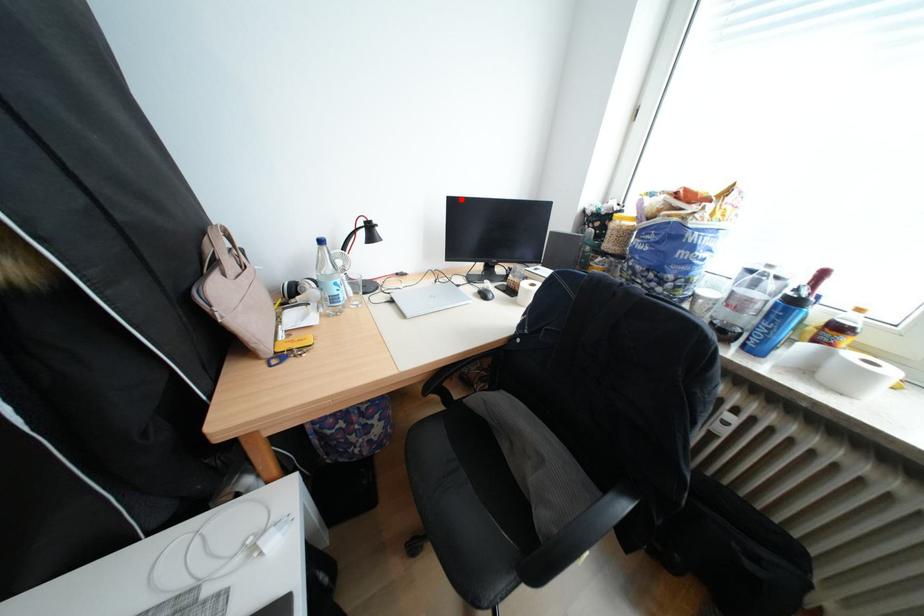
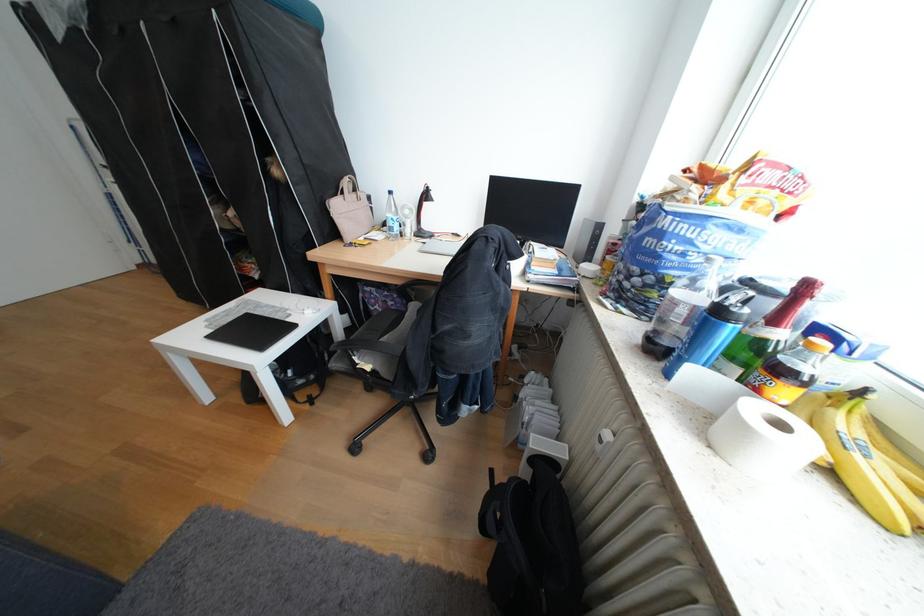
In the second image, find the point that corresponds to the highlighted location in the first image.

(504, 177)